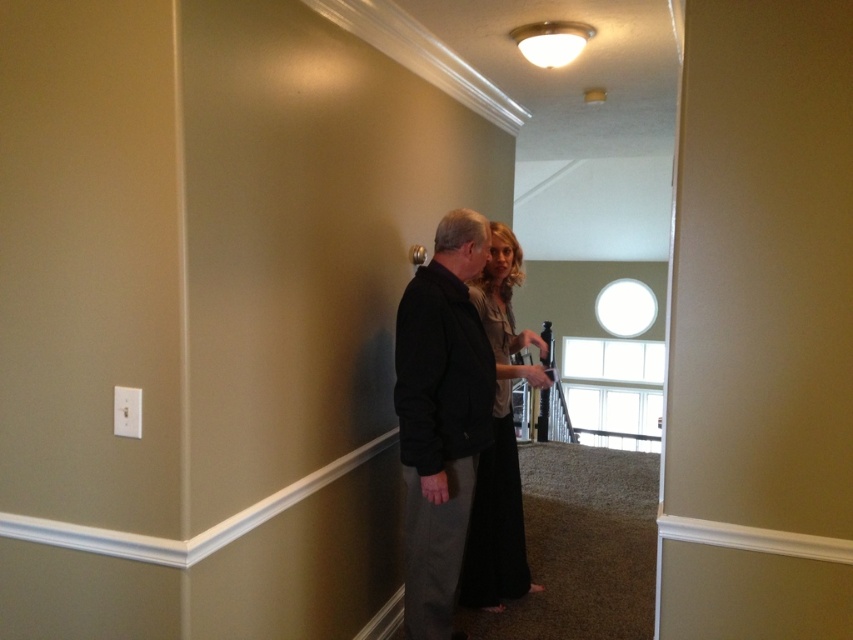
Question: Can you confirm if black matte jacket at center is thinner than black silk dress at center?

Choices:
 (A) no
 (B) yes

Answer: (B)

Question: Among these points, which one is farthest from the camera?

Choices:
 (A) (426, 433)
 (B) (495, 513)

Answer: (B)

Question: Where is black matte jacket at center located in relation to black silk dress at center in the image?

Choices:
 (A) above
 (B) below

Answer: (A)

Question: Which point is farther to the camera?

Choices:
 (A) black matte jacket at center
 (B) black silk dress at center

Answer: (B)

Question: Which point appears farthest from the camera in this image?

Choices:
 (A) [453, 547]
 (B) [485, 269]

Answer: (B)

Question: Can you confirm if black matte jacket at center is positioned above black silk dress at center?

Choices:
 (A) yes
 (B) no

Answer: (A)